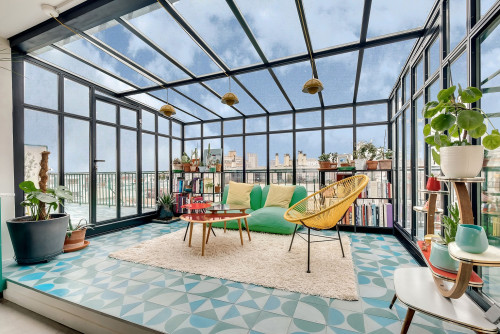
Locate an element on the screen. tile floor is located at coordinates (110, 285).